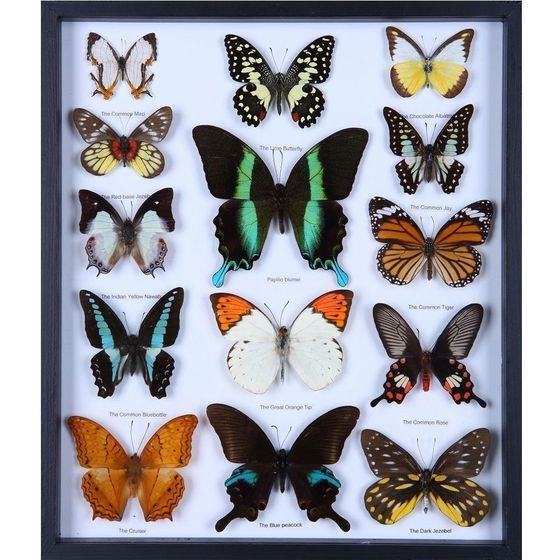
The width and height of the screenshot is (560, 560). Find the location of `inner corners`. inner corners is located at coordinates (62, 534), (497, 535), (499, 20), (60, 17).